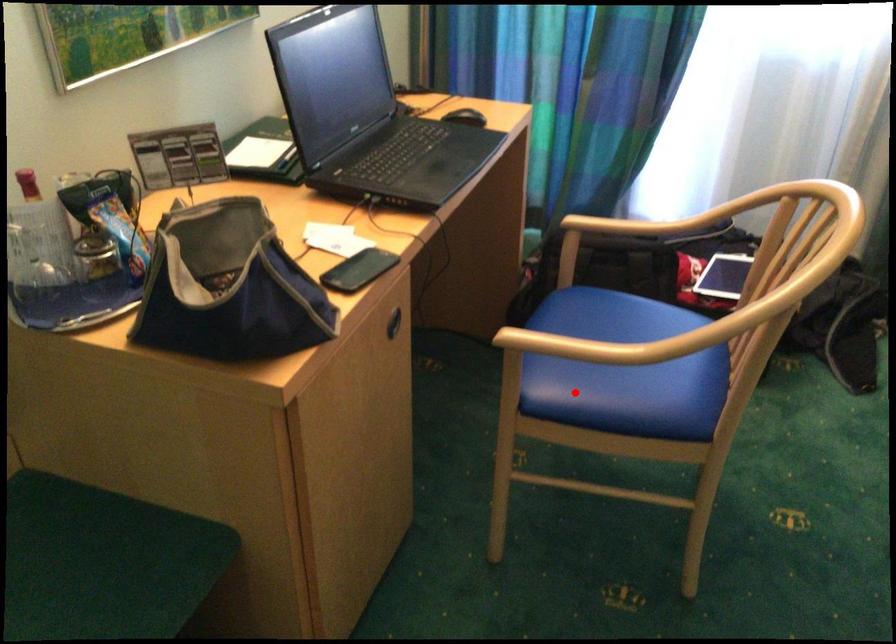
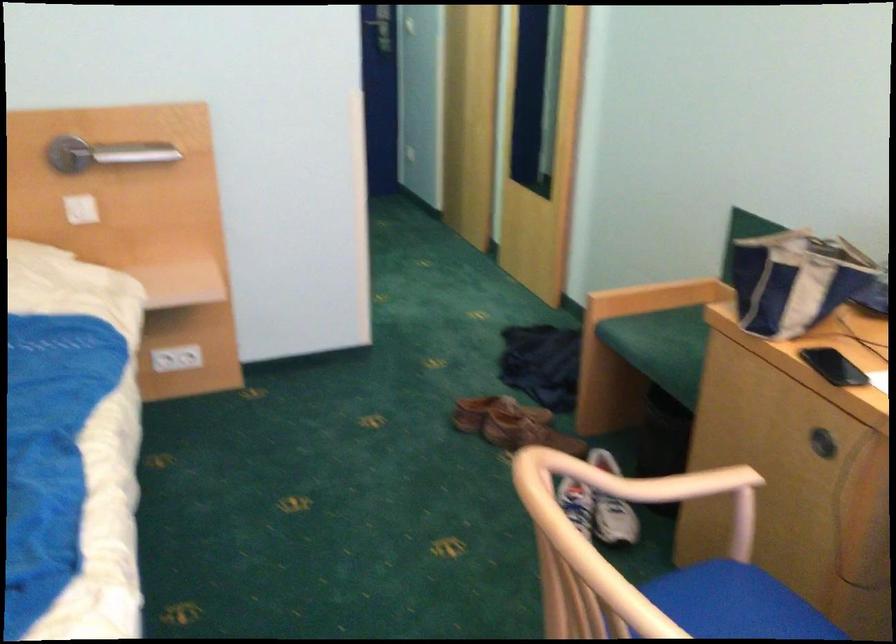
Question: I am providing you with two images of the same scene from different viewpoints. Image1 has a red point marked. In image2, the corresponding 3D location appears at what relative position? Reply with the corresponding letter.

Choices:
 (A) Closer
 (B) Farther

Answer: (A)